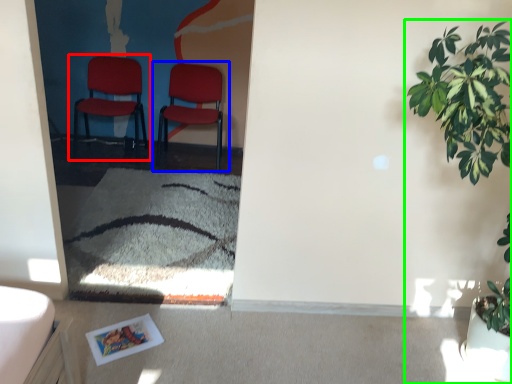
Question: Which object is the closest to the chair (highlighted by a red box)? Choose among these: chair (highlighted by a blue box) or houseplant (highlighted by a green box).

Choices:
 (A) chair
 (B) houseplant

Answer: (A)